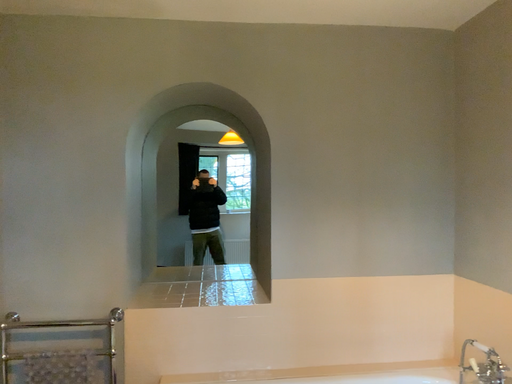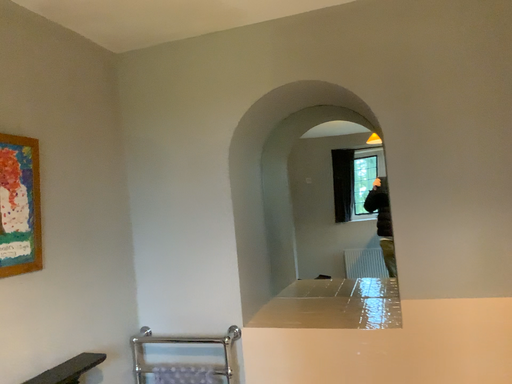
Question: How did the camera likely rotate when shooting the video?

Choices:
 (A) rotated left
 (B) rotated right

Answer: (A)